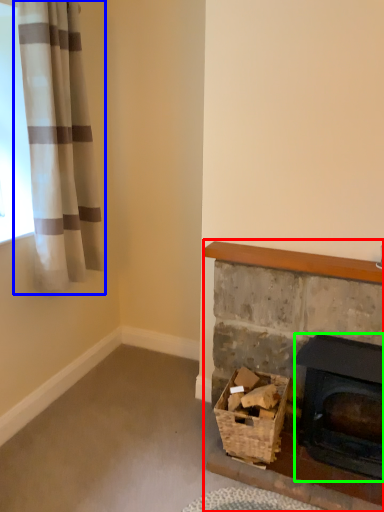
Question: Based on their relative distances, which object is farther from fireplace (highlighted by a red box)? Choose from curtain (highlighted by a blue box) and fireplace (highlighted by a green box).

Choices:
 (A) curtain
 (B) fireplace

Answer: (A)